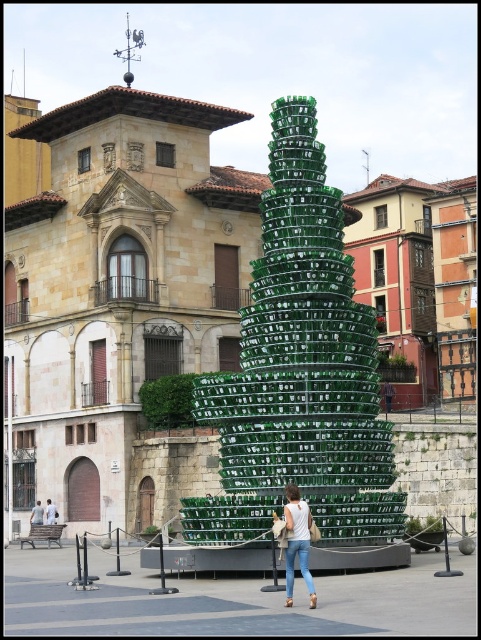
You are standing in the town square and want to take a photo of the green glass christmas tree at center without any people in the frame. There are white denim jeans at lower center blocking your view. Which object should you move to get a clear shot?

You should move the white denim jeans at lower center because the green glass christmas tree at center is closer to you than the white denim jeans at lower center, so moving the closer object will allow you to see the tree without obstruction.

You are a photographer trying to capture the green glass christmas tree at center and the white cotton shirts at center in the same frame. Which object should you focus on first to ensure both are in the frame?

The green glass christmas tree at center is located above the white cotton shirts at center, so you should focus on the white cotton shirts at center first to ensure both are in the frame.

You are standing in the town square and notice a large conical sculpture made of green glass bottles. There are ropes and stanchions around it. What object is located at the coordinates point [296,541]?

The point [296,541] marks white denim jeans at lower center.